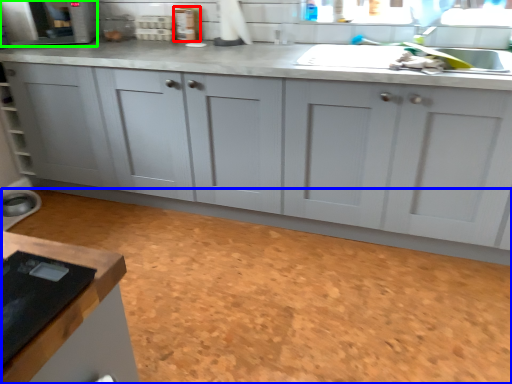
Question: Considering the real-world distances, which object is farthest from appliance (highlighted by a red box)? granite (highlighted by a blue box) or appliance (highlighted by a green box)?

Choices:
 (A) granite
 (B) appliance

Answer: (A)